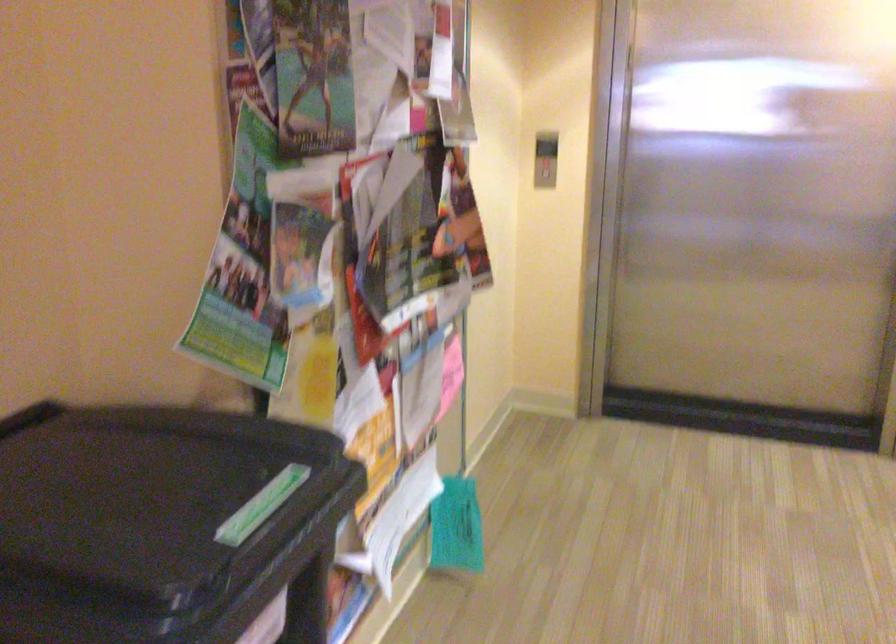
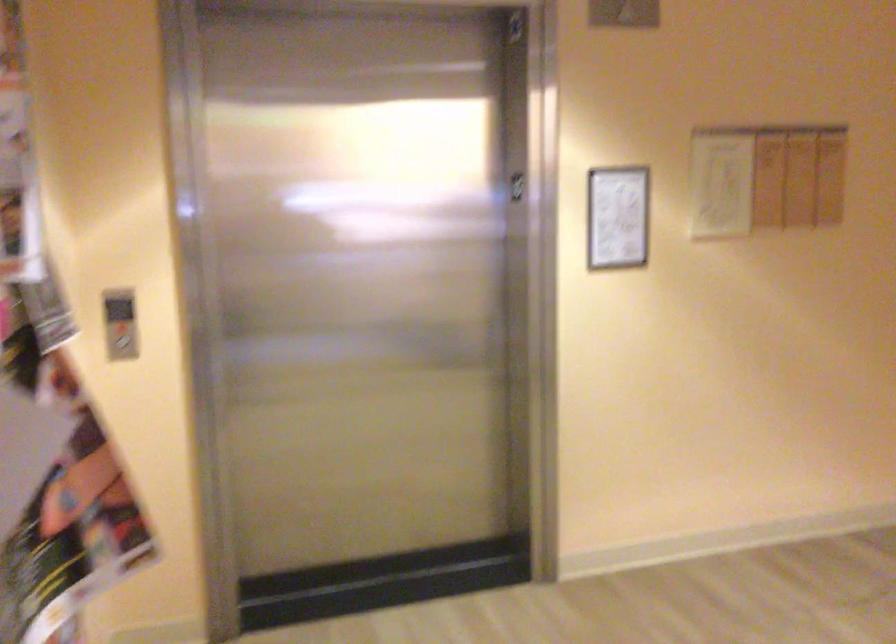
The point at [528,171] is marked in the first image. Where is the corresponding point in the second image?

(122, 343)